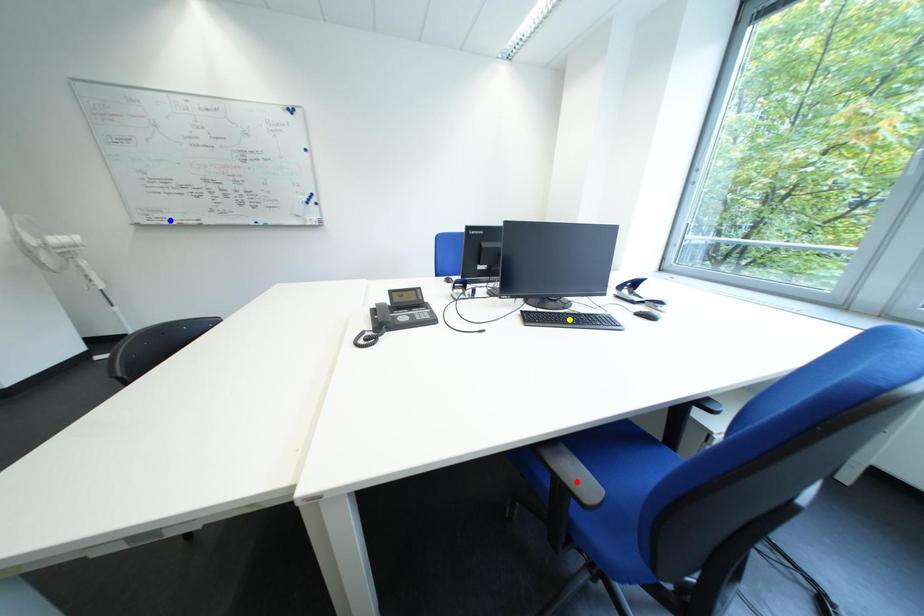
Order these from nearest to farthest:
yellow point, blue point, red point

red point
yellow point
blue point